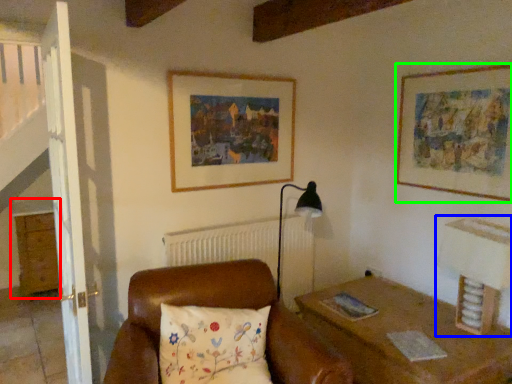
Question: Which object is the closest to the dresser (highlighted by a red box)? Choose among these: table lamp (highlighted by a blue box) or picture frame (highlighted by a green box).

Choices:
 (A) table lamp
 (B) picture frame

Answer: (B)